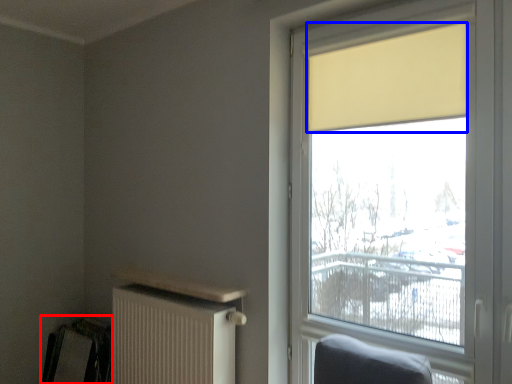
Question: Which object is further to the camera taking this photo, swivel chair (highlighted by a red box) or curtain (highlighted by a blue box)?

Choices:
 (A) swivel chair
 (B) curtain

Answer: (A)